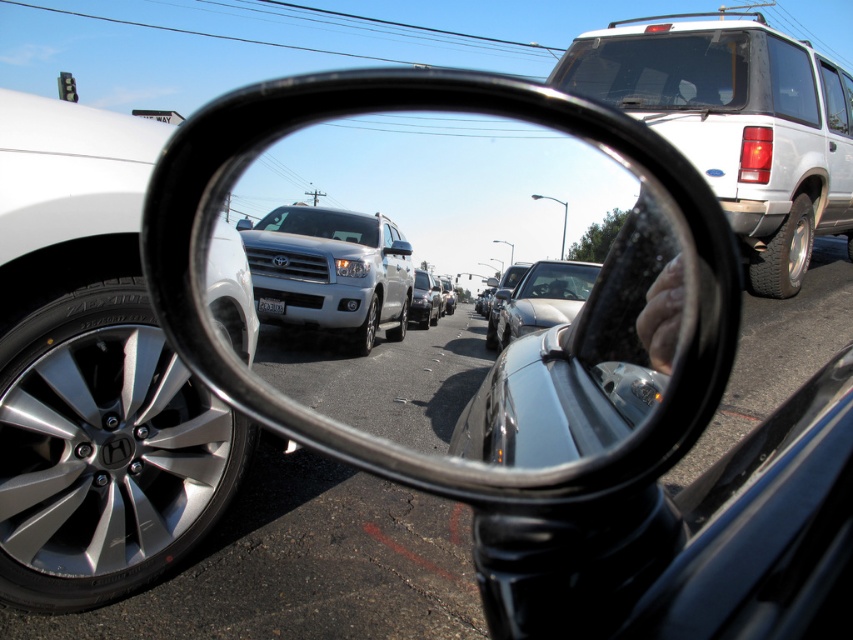
You are a driver checking your side mirror to merge into traffic. You see a point in the mirror at coordinates (x=293, y=77). If the recommended safe distance for merging is 5 feet, is the point within a safe distance for merging?

The point at (x=293, y=77) is 6.01 feet away from the camera, which is slightly beyond the recommended safe distance of 5 feet for merging. Therefore, it may not be safe to merge at this point.

You are driving a car and need to change lanes. You look at the glossy metallic mirror at center and see the shiny silver sedan at center in the reflection. Based on their positions, can you safely change lanes without risking a collision?

The glossy metallic mirror at center is 5.95 meters from the shiny silver sedan at center. Since the distance between them is sufficient, you can safely change lanes without risking a collision.

You are a driver looking at the convex side mirror of your car. You notice two points marked in the reflection. The first point is at coordinates point (454,342) and the second is at point (651,552). Which point is closer to the mirror surface?

Point (651,552) is closer to the mirror surface because it is less further to the camera than point (454,342).